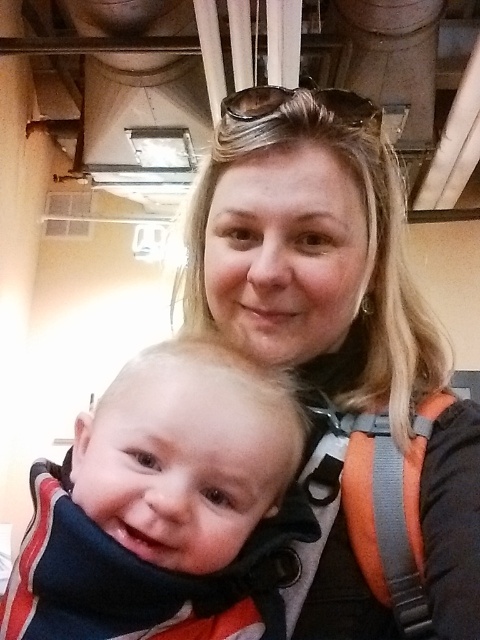
Can you confirm if blonde hair at center is shorter than soft white scarf at center?

In fact, blonde hair at center may be taller than soft white scarf at center.

Does blonde hair at center appear on the left side of soft white scarf at center?

In fact, blonde hair at center is to the right of soft white scarf at center.

Which is in front, point (275, 237) or point (241, 620)?

Point (241, 620) is more forward.

At what (x,y) coordinates should I click in order to perform the action: click on blonde hair at center. Please return your answer as a coordinate pair (x, y). Image resolution: width=480 pixels, height=640 pixels. Looking at the image, I should click on (340, 349).